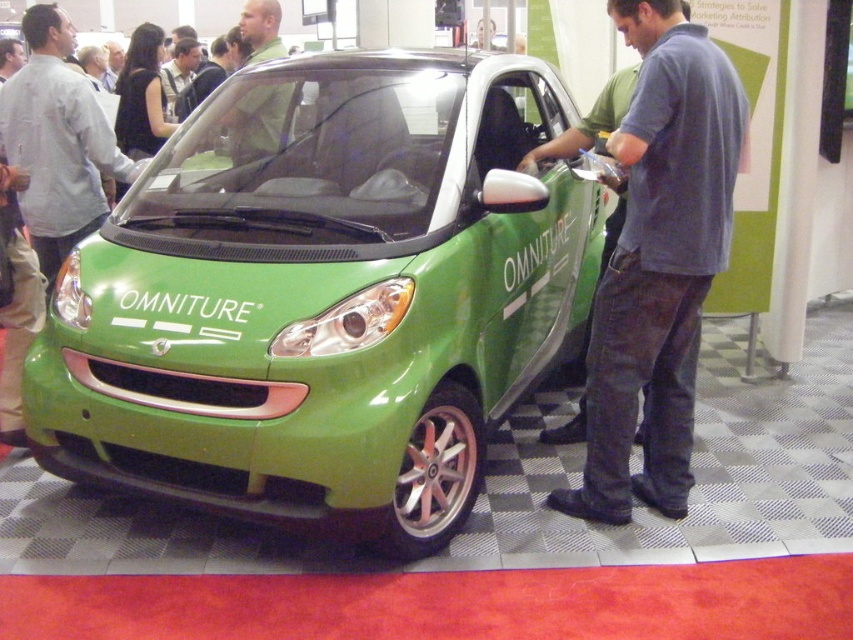
Which is above, green glossy car at center or green matte shirt at center?

Positioned higher is green matte shirt at center.

Is green glossy car at center positioned before green matte shirt at center?

Yes, green glossy car at center is closer to the viewer.

Image resolution: width=853 pixels, height=640 pixels. In order to click on green glossy car at center in this screenshot , I will do `click(325, 298)`.

Looking at this image, is green glossy car at center thinner than light brown leather jacket at upper center?

Incorrect, green glossy car at center's width is not less than light brown leather jacket at upper center's.

Which of these two, green glossy car at center or light brown leather jacket at upper center, stands shorter?

light brown leather jacket at upper center is shorter.

Does point (215, 280) lie behind point (177, 116)?

No.

Locate an element on the screen. The width and height of the screenshot is (853, 640). green glossy car at center is located at coordinates click(325, 298).

Which of these two, matte gray shirt at center or light brown leather jacket at upper center, stands taller?

matte gray shirt at center

At what (x,y) coordinates should I click in order to perform the action: click on matte gray shirt at center. Please return your answer as a coordinate pair (x, y). Looking at the image, I should click on (57, 141).